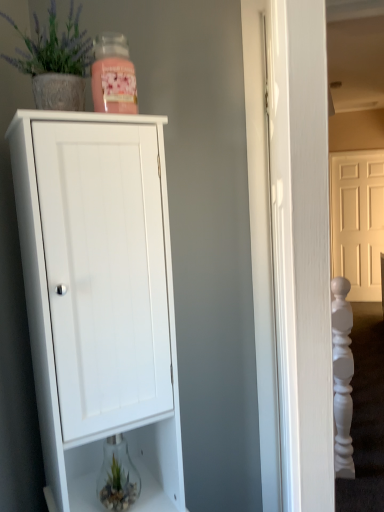
Question: Is white matte cabinet at center wider than clear glass vase at lower center?

Choices:
 (A) yes
 (B) no

Answer: (A)

Question: Is white matte cabinet at center directly adjacent to clear glass vase at lower center?

Choices:
 (A) no
 (B) yes

Answer: (A)

Question: Is white matte cabinet at center shorter than clear glass vase at lower center?

Choices:
 (A) no
 (B) yes

Answer: (A)

Question: From a real-world perspective, is white matte cabinet at center beneath clear glass vase at lower center?

Choices:
 (A) no
 (B) yes

Answer: (A)

Question: Is clear glass vase at lower center completely or partially inside white matte cabinet at center?

Choices:
 (A) no
 (B) yes

Answer: (B)

Question: Could you tell me if white matte cabinet at center is turned towards clear glass vase at lower center?

Choices:
 (A) yes
 (B) no

Answer: (A)

Question: Does white matte cabinet at center touch yellow matte door at upper right?

Choices:
 (A) yes
 (B) no

Answer: (B)

Question: Is white matte cabinet at center not near yellow matte door at upper right?

Choices:
 (A) yes
 (B) no

Answer: (A)

Question: Is yellow matte door at upper right at the back of white matte cabinet at center?

Choices:
 (A) no
 (B) yes

Answer: (A)

Question: Does white matte cabinet at center have a lesser height compared to yellow matte door at upper right?

Choices:
 (A) yes
 (B) no

Answer: (A)

Question: Is white matte cabinet at center surrounding yellow matte door at upper right?

Choices:
 (A) yes
 (B) no

Answer: (B)

Question: Considering the relative sizes of white matte cabinet at center and yellow matte door at upper right in the image provided, is white matte cabinet at center thinner than yellow matte door at upper right?

Choices:
 (A) yes
 (B) no

Answer: (B)

Question: Would you say yellow matte door at upper right contains clear glass vase at lower center?

Choices:
 (A) yes
 (B) no

Answer: (B)